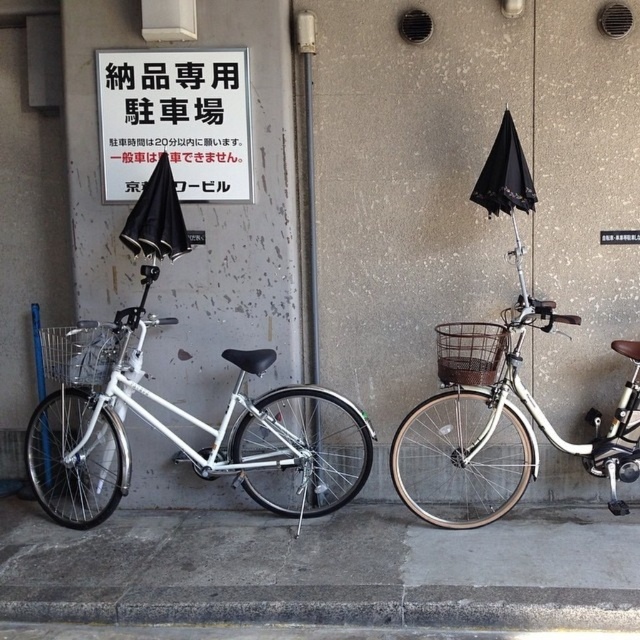
Can you confirm if white matte bicycle at left is positioned to the right of silver metallic basket at left?

Indeed, white matte bicycle at left is positioned on the right side of silver metallic basket at left.

The image size is (640, 640). Identify the location of white matte bicycle at left. (164, 426).

Is white matte bicycle at left further to camera compared to black matte umbrella at left?

Yes, it is behind black matte umbrella at left.

What do you see at coordinates (164, 426) in the screenshot?
I see `white matte bicycle at left` at bounding box center [164, 426].

Who is more distant from viewer, (349, 490) or (163, 172)?

The point (349, 490) is more distant.

I want to click on white matte bicycle at left, so click(x=164, y=426).

The width and height of the screenshot is (640, 640). What do you see at coordinates (156, 218) in the screenshot?
I see `black matte umbrella at left` at bounding box center [156, 218].

Locate an element on the screen. This screenshot has height=640, width=640. black matte umbrella at left is located at coordinates (156, 218).

Identify the location of black matte umbrella at left. The width and height of the screenshot is (640, 640). (156, 218).

Identify the location of black matte umbrella at left. The width and height of the screenshot is (640, 640). (156, 218).